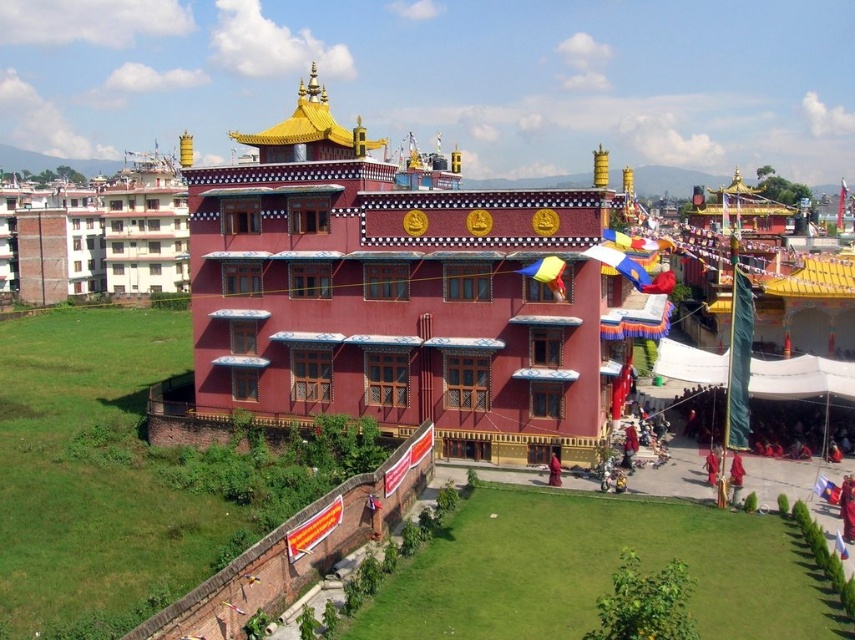
Question: Which point is farther to the camera?

Choices:
 (A) golden fabric robe at lower right
 (B) red velvet robe at lower right

Answer: (A)

Question: Can you confirm if matte red building at center is wider than golden fabric robe at lower right?

Choices:
 (A) no
 (B) yes

Answer: (B)

Question: Can you confirm if golden fabric robe at lower right is positioned above reddish-brown monk at lower center?

Choices:
 (A) no
 (B) yes

Answer: (A)

Question: Where is golden fabric robe at lower right located in relation to reddish-brown monk at lower center in the image?

Choices:
 (A) above
 (B) below

Answer: (B)

Question: Which object is positioned closest to the golden fabric robe at lower right?

Choices:
 (A) reddish-brown monk at lower center
 (B) red velvet robe at lower right

Answer: (B)

Question: Which point is farther to the camera?

Choices:
 (A) (733, 483)
 (B) (311, 291)

Answer: (B)